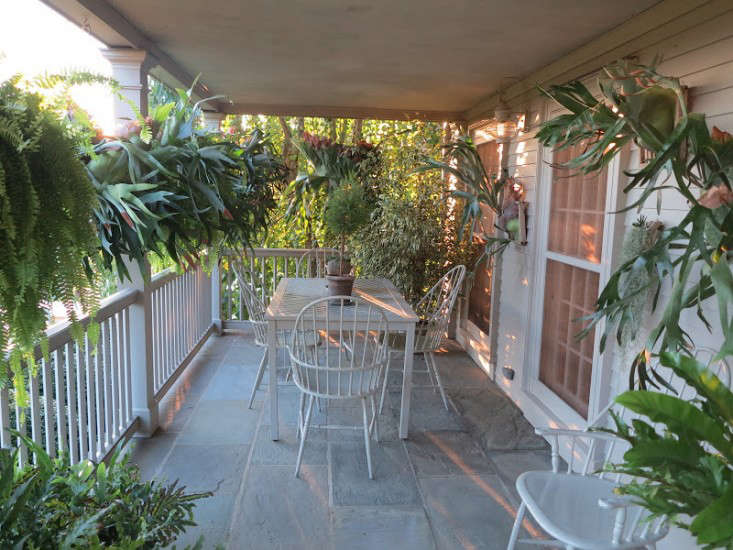
Find the location of `chair`. chair is located at coordinates (344, 382), (429, 337).